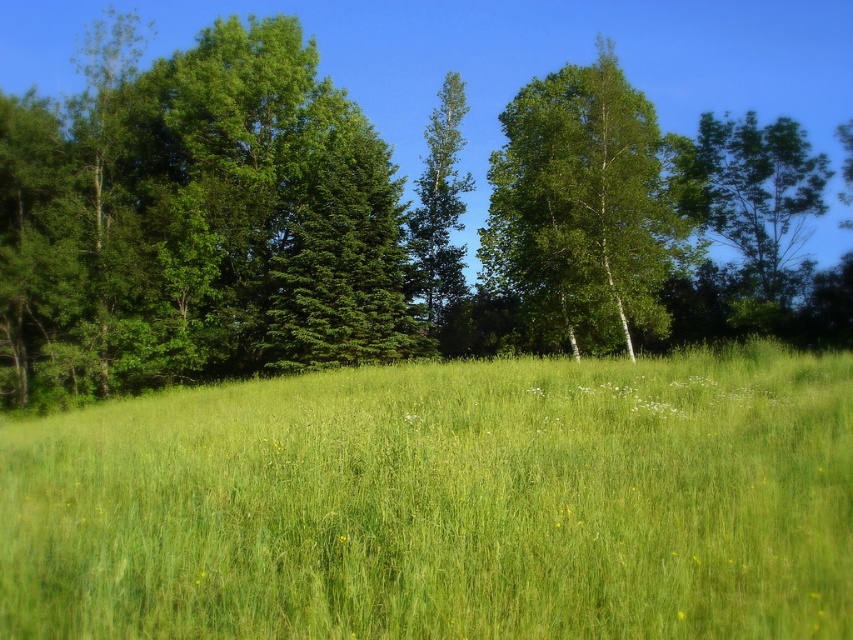
You are standing in the meadow and want to find the tallest green leafy tree between the green leafy tree at upper right and the green leafy tree at center. Which one should you look towards?

The green leafy tree at center is taller than the green leafy tree at upper right, so you should look towards the center to find the tallest one.

You are standing in the middle of the green grassy field at center and want to reach the green bark tree at right. Which direction should you move to get closer to the tree?

You should move to the right because the green grassy field at center is to the left of the green bark tree at right, so moving right will bring you closer to the tree.

You are standing in the meadow and see the point marked at coordinates (373,221). Which object in the scene does this point lie on?

The point at coordinates (373,221) lies on the green leafy tree at upper center.